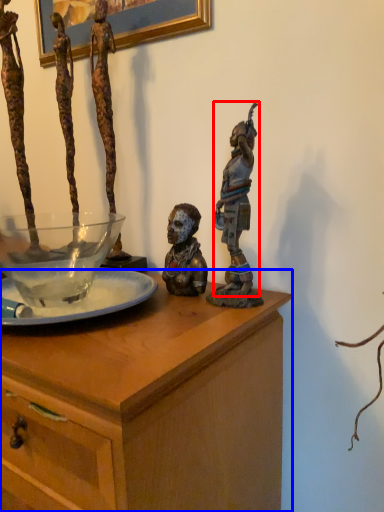
Question: Among these objects, which one is nearest to the camera, person (highlighted by a red box) or table (highlighted by a blue box)?

Choices:
 (A) person
 (B) table

Answer: (B)